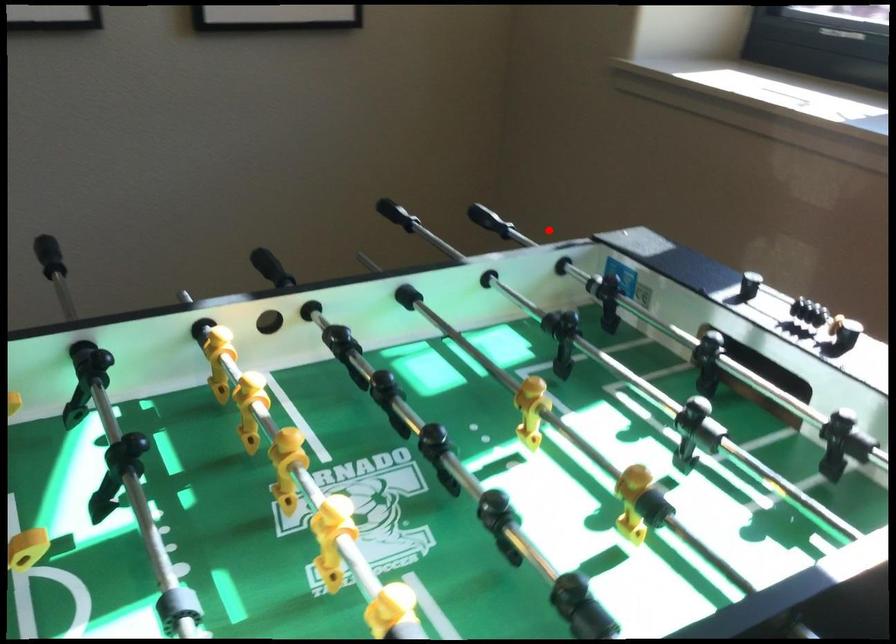
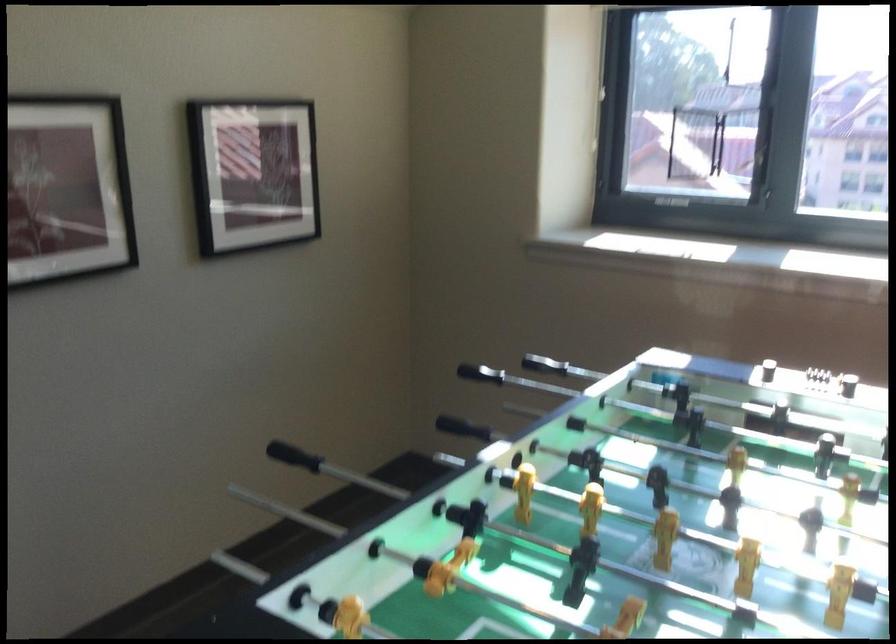
Locate, in the second image, the point that corresponds to the highlighted location in the first image.

(479, 373)